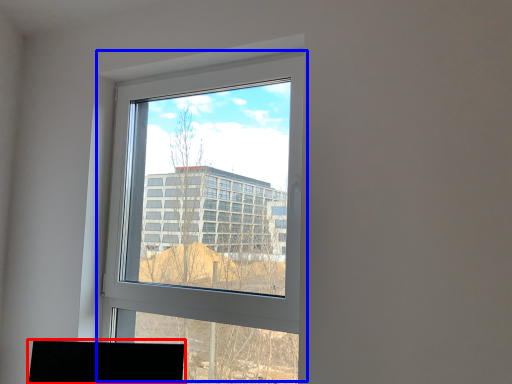
Question: Which point is closer to the camera, desktop (highlighted by a red box) or window (highlighted by a blue box)?

Choices:
 (A) desktop
 (B) window

Answer: (B)